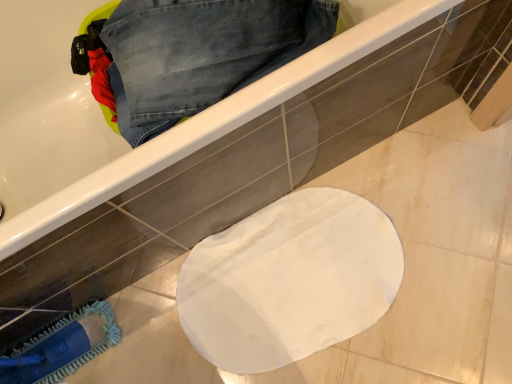
Question: Is white glossy bathtub at upper center oriented towards denim at upper left?

Choices:
 (A) no
 (B) yes

Answer: (B)

Question: Does white glossy bathtub at upper center appear on the right side of denim at upper left?

Choices:
 (A) yes
 (B) no

Answer: (B)

Question: Is white glossy bathtub at upper center positioned before denim at upper left?

Choices:
 (A) no
 (B) yes

Answer: (B)

Question: From the image's perspective, is white glossy bathtub at upper center below denim at upper left?

Choices:
 (A) no
 (B) yes

Answer: (B)

Question: Can you confirm if white glossy bathtub at upper center is wider than denim at upper left?

Choices:
 (A) no
 (B) yes

Answer: (B)

Question: Does white glossy bathtub at upper center come behind denim at upper left?

Choices:
 (A) no
 (B) yes

Answer: (A)

Question: Considering the relative sizes of denim at upper left and white glossy bathtub at upper center in the image provided, is denim at upper left thinner than white glossy bathtub at upper center?

Choices:
 (A) no
 (B) yes

Answer: (B)

Question: Can you confirm if denim at upper left is bigger than white glossy bathtub at upper center?

Choices:
 (A) yes
 (B) no

Answer: (B)

Question: Is denim at upper left surrounding white glossy bathtub at upper center?

Choices:
 (A) no
 (B) yes

Answer: (A)

Question: Considering the relative positions of denim at upper left and white glossy bathtub at upper center in the image provided, is denim at upper left to the right of white glossy bathtub at upper center from the viewer's perspective?

Choices:
 (A) yes
 (B) no

Answer: (A)

Question: From the image's perspective, does denim at upper left appear higher than white glossy bathtub at upper center?

Choices:
 (A) yes
 (B) no

Answer: (A)

Question: Is denim at upper left looking in the opposite direction of white glossy bathtub at upper center?

Choices:
 (A) no
 (B) yes

Answer: (B)

Question: Could you tell me if white glossy bathtub at upper center is facing blue fabric brush at lower left?

Choices:
 (A) no
 (B) yes

Answer: (B)